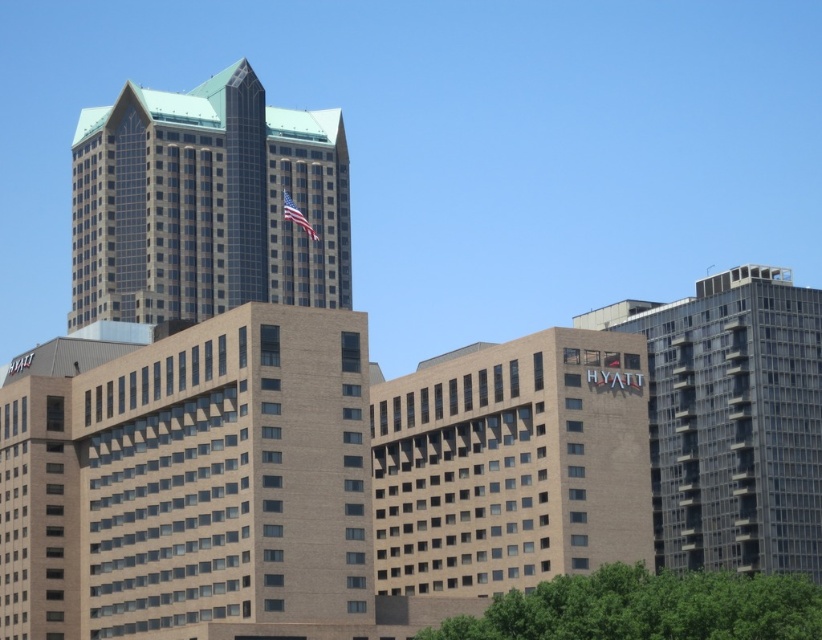
Does glassy reflective building at right appear over green leafy tree at lower center?

Indeed, glassy reflective building at right is positioned over green leafy tree at lower center.

Is point (709, 368) behind point (684, 636)?

Yes, point (709, 368) is behind point (684, 636).

At what (x,y) coordinates should I click in order to perform the action: click on glassy reflective building at right. Please return your answer as a coordinate pair (x, y). Looking at the image, I should click on (733, 420).

Is green glass skyscraper at upper left below green leafy tree at lower center?

No.

Is point (321, 269) more distant than point (633, 588)?

That is True.

Locate an element on the screen. The image size is (822, 640). green glass skyscraper at upper left is located at coordinates (206, 204).

Can you confirm if green glass skyscraper at upper left is bigger than glassy reflective building at right?

Indeed, green glass skyscraper at upper left has a larger size compared to glassy reflective building at right.

Who is positioned more to the right, green glass skyscraper at upper left or glassy reflective building at right?

glassy reflective building at right is more to the right.

Who is more forward, (319,243) or (760,336)?

Point (760,336)

Find the location of a particular element. This screenshot has width=822, height=640. green glass skyscraper at upper left is located at coordinates (206, 204).